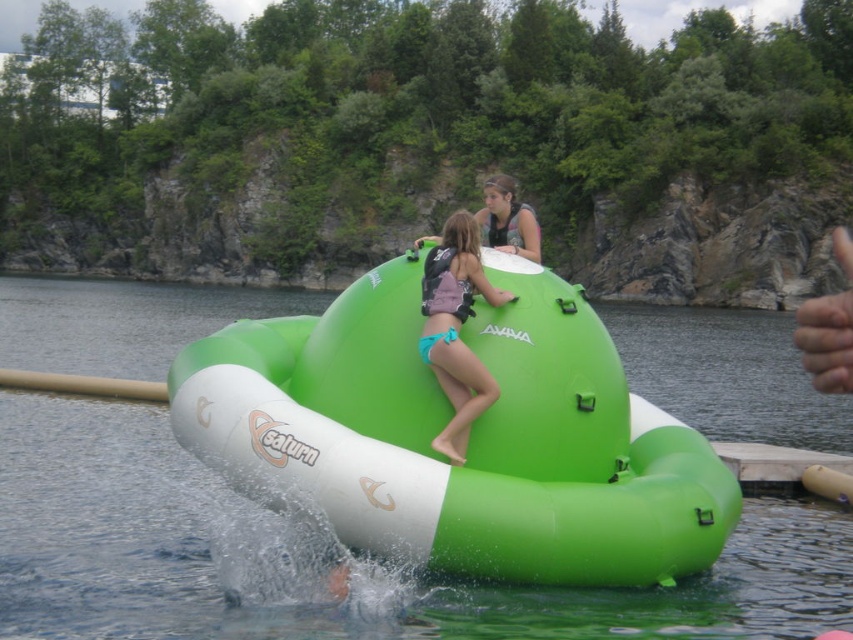
From the picture: You are a photographer planning to take a photo of the green rubber boat at center and the teal fabric bikini at center. Given their sizes, which object should you focus on first to ensure both are in frame without zooming in or out?

The green rubber boat at center is smaller than the teal fabric bikini at center, so you should focus on the teal fabric bikini at center first to ensure it fits within the frame while accommodating the smaller boat.